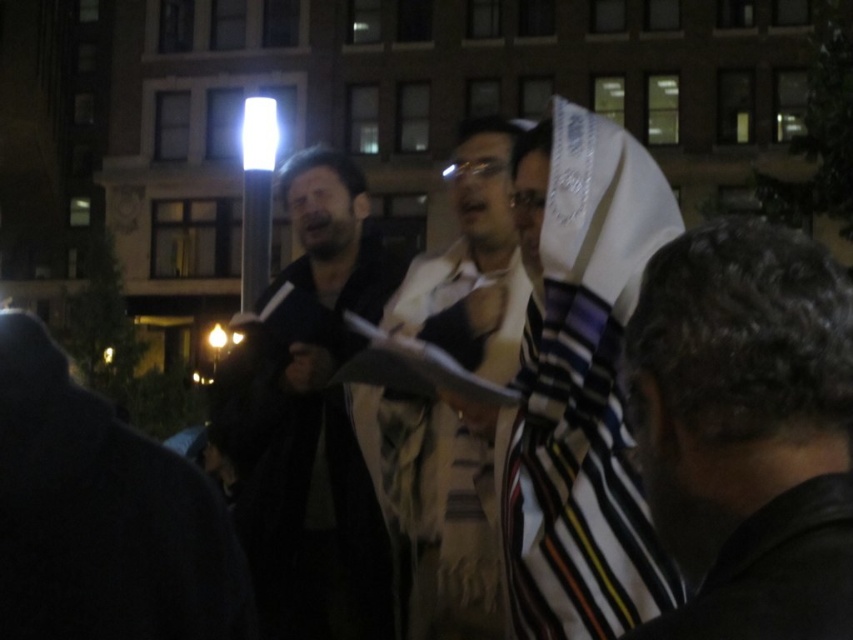
You are a photographer standing in the middle of the scene. You want to take a photo of the dark curly hair at lower right and the dark matte jacket at center. Which object should you focus on first to ensure both are in the frame?

The dark curly hair at lower right is positioned over the dark matte jacket at center, so you should focus on the dark curly hair at lower right first to ensure both are in the frame.

Looking at this image, you are a photographer trying to capture a portrait of the person with dark curly hair at lower right and the person with white textured scarf at center. Which person should you focus on first if you want to include both in the frame without moving the camera?

You should focus on the white textured scarf at center first because the dark curly hair at lower right is positioned to its right, so keeping the scarf centered will allow both subjects to be included in the frame.

You are organizing a small event and need to know the spatial relationship between the dark matte jacket at center and the white textured scarf at center. Which object is wider?

The dark matte jacket at center is wider than the white textured scarf at center.